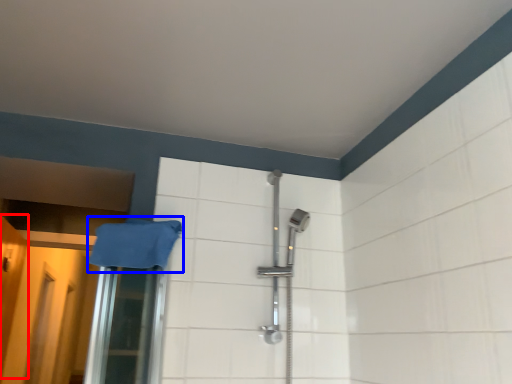
Question: Among these objects, which one is farthest to the camera, door (highlighted by a red box) or bath towel (highlighted by a blue box)?

Choices:
 (A) door
 (B) bath towel

Answer: (A)